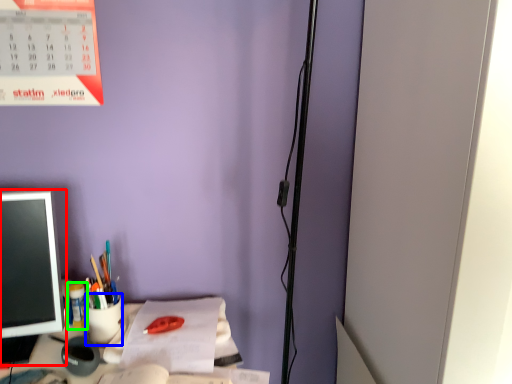
Question: Which object is positioned farthest from office supplies (highlighted by a red box)? Select from stationery (highlighted by a blue box) and stationery (highlighted by a green box).

Choices:
 (A) stationery
 (B) stationery

Answer: (A)